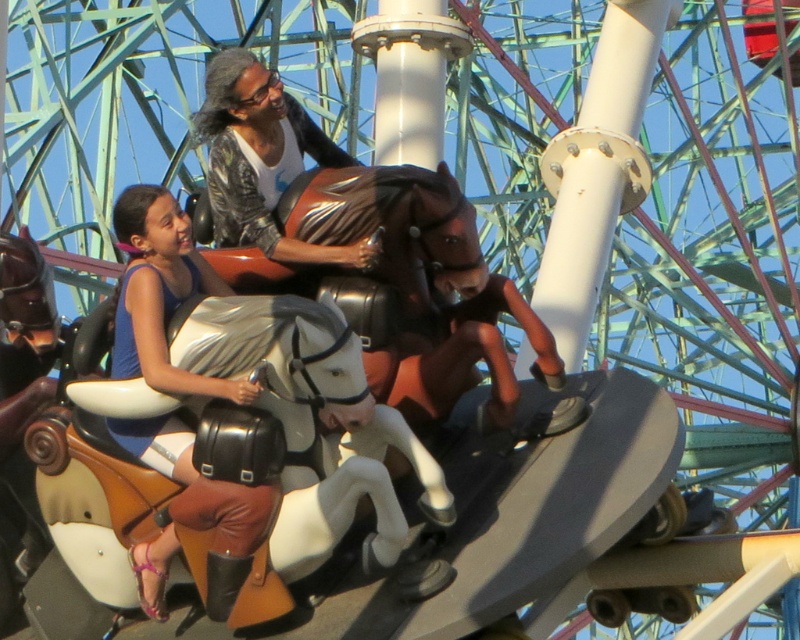
Question: Is matte black vest at center above matte black jacket at upper center?

Choices:
 (A) yes
 (B) no

Answer: (B)

Question: Can you confirm if matte black vest at center is thinner than matte black jacket at upper center?

Choices:
 (A) no
 (B) yes

Answer: (B)

Question: Does matte black vest at center lie in front of matte black jacket at upper center?

Choices:
 (A) no
 (B) yes

Answer: (B)